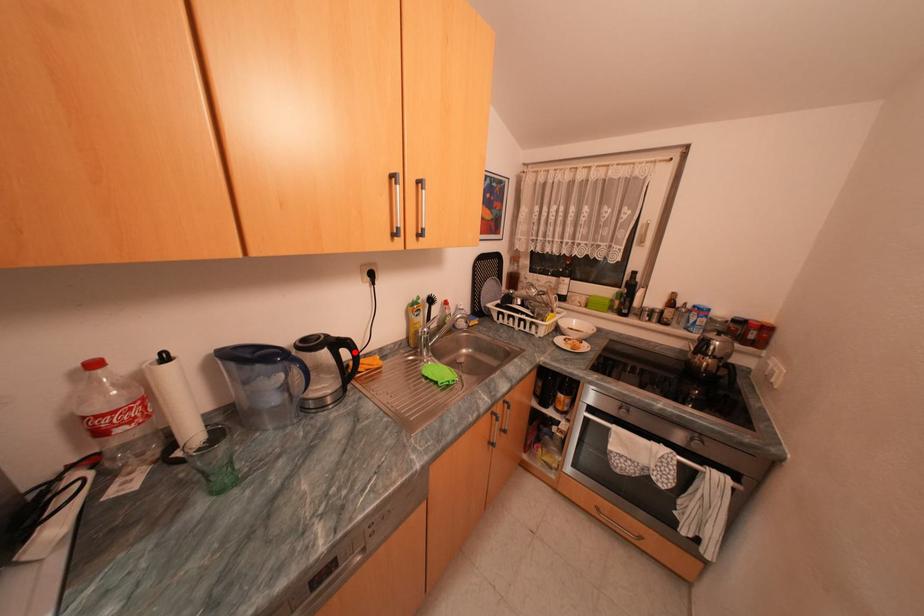
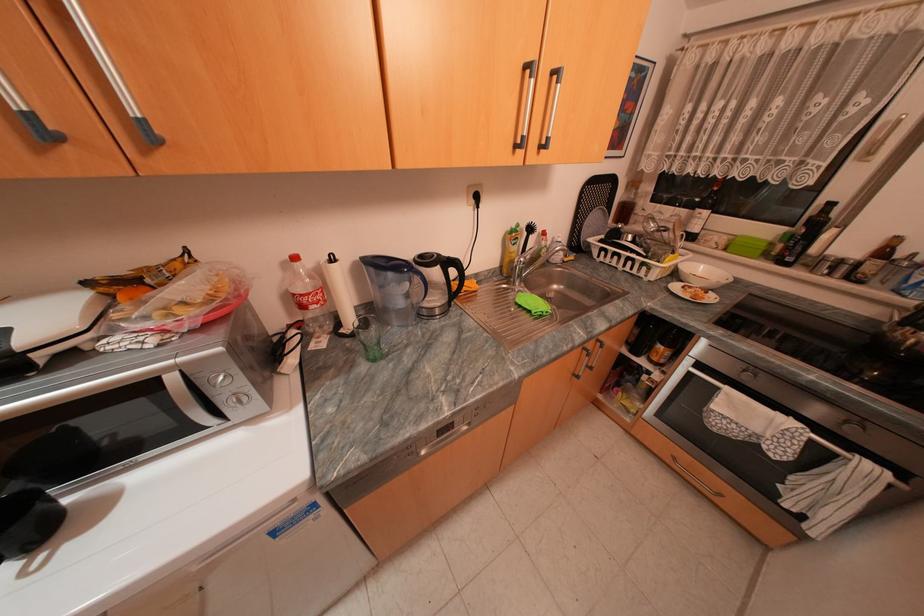
The point at the highlighted location is marked in the first image. Where is the corresponding point in the second image?

(463, 270)